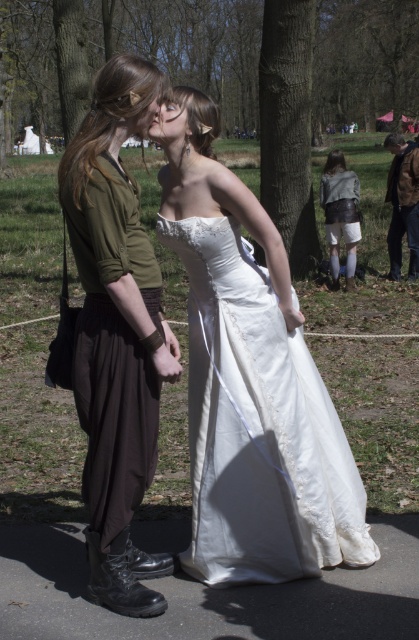
Question: Which point is farther to the camera?

Choices:
 (A) (136, 129)
 (B) (88, 163)

Answer: (A)

Question: Is satin white dress at center in front of brown leather jacket at right?

Choices:
 (A) no
 (B) yes

Answer: (B)

Question: Which object is positioned farthest from the satin white dress at center?

Choices:
 (A) matte white dress at center
 (B) matte green shirt at center

Answer: (B)

Question: Considering the real-world distances, which object is farthest from the matte green shirt at center?

Choices:
 (A) brown leather jacket at right
 (B) satin white dress at center

Answer: (A)

Question: Is matte green shirt at center bigger than brown leather jacket at right?

Choices:
 (A) no
 (B) yes

Answer: (A)

Question: Can you confirm if satin white dress at center is wider than brown leather jacket at right?

Choices:
 (A) yes
 (B) no

Answer: (B)